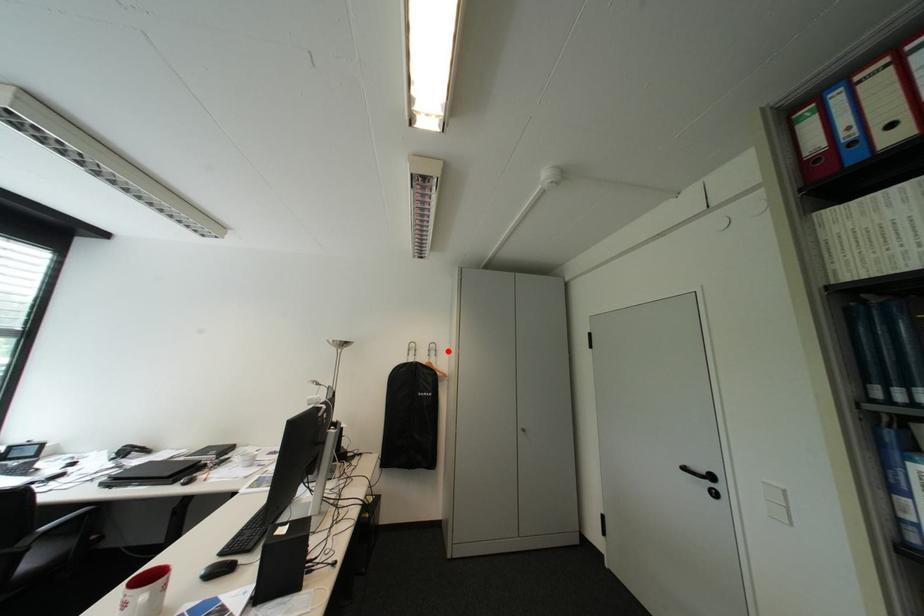
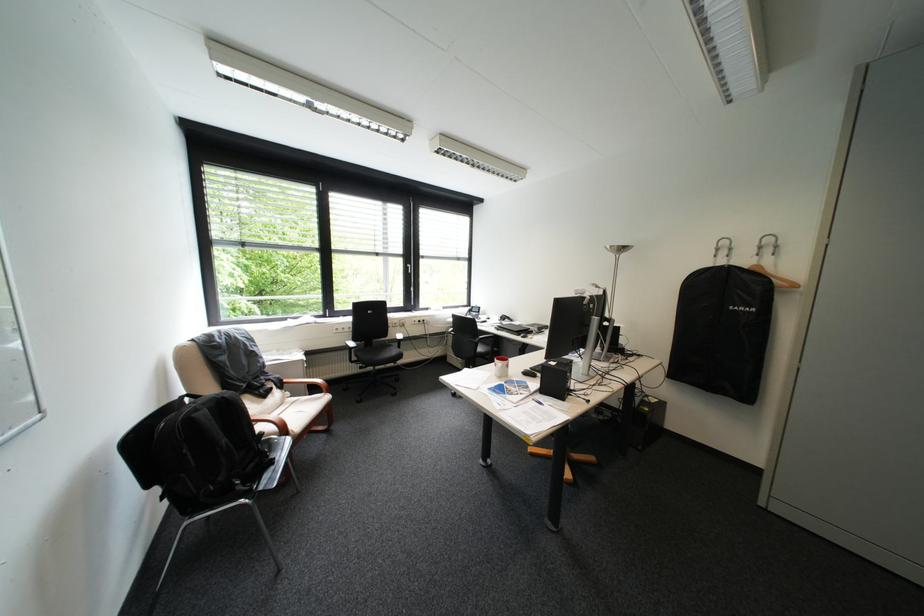
Question: I am providing you with two images of the same scene from different viewpoints. A red point is marked on the first image. Is the red point's position out of view in image 2?

Choices:
 (A) Yes
 (B) No

Answer: (B)